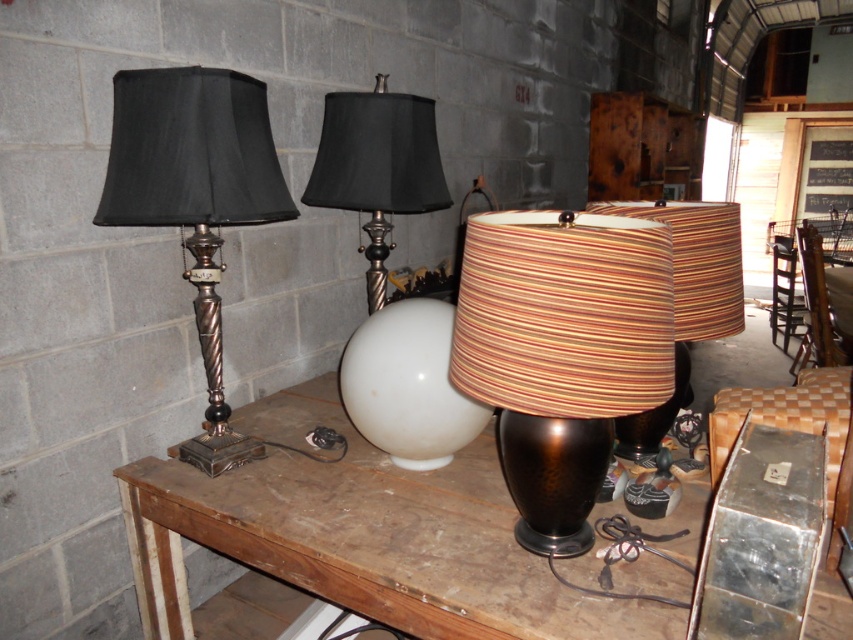
Question: Does matte black lampshade at center appear over striped fabric lampshade at center?

Choices:
 (A) yes
 (B) no

Answer: (A)

Question: Which is nearer to the brown striped lampshade at center?

Choices:
 (A) striped fabric lampshade at center
 (B) brown wooden table at center
 (C) matte black lampshade at center

Answer: (A)

Question: Which point is farther to the camera?

Choices:
 (A) white glossy sphere at center
 (B) striped fabric lampshade at center
 (C) matte black lampshade at left
 (D) brown striped lampshade at center

Answer: (A)

Question: Does brown wooden table at center have a larger size compared to white glossy sphere at center?

Choices:
 (A) no
 (B) yes

Answer: (B)

Question: Which object appears closest to the camera in this image?

Choices:
 (A) white glossy sphere at center
 (B) brown striped lampshade at center
 (C) brown wooden table at center

Answer: (B)

Question: Can you confirm if matte black lampshade at left is bigger than striped fabric lampshade at center?

Choices:
 (A) yes
 (B) no

Answer: (B)